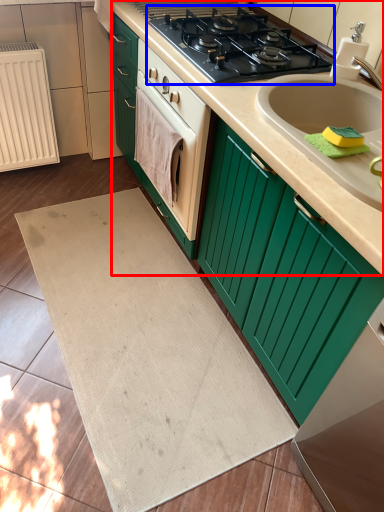
Question: Which object is further to the camera taking this photo, counter top (highlighted by a red box) or gas stove (highlighted by a blue box)?

Choices:
 (A) counter top
 (B) gas stove

Answer: (B)